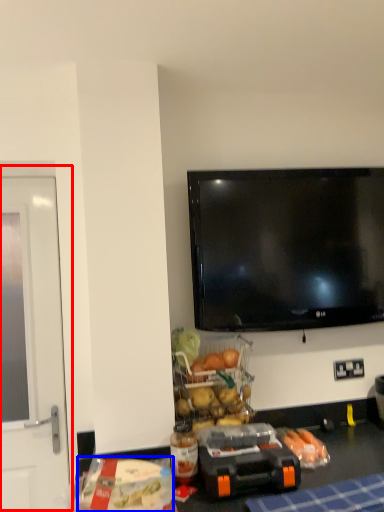
Question: Which object is further to the camera taking this photo, screen door (highlighted by a red box) or food (highlighted by a blue box)?

Choices:
 (A) screen door
 (B) food

Answer: (A)